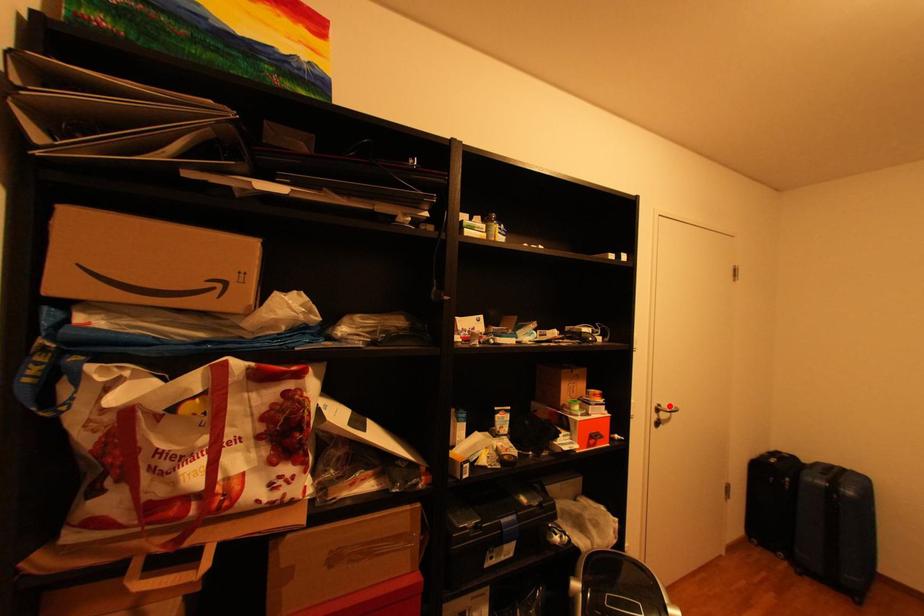
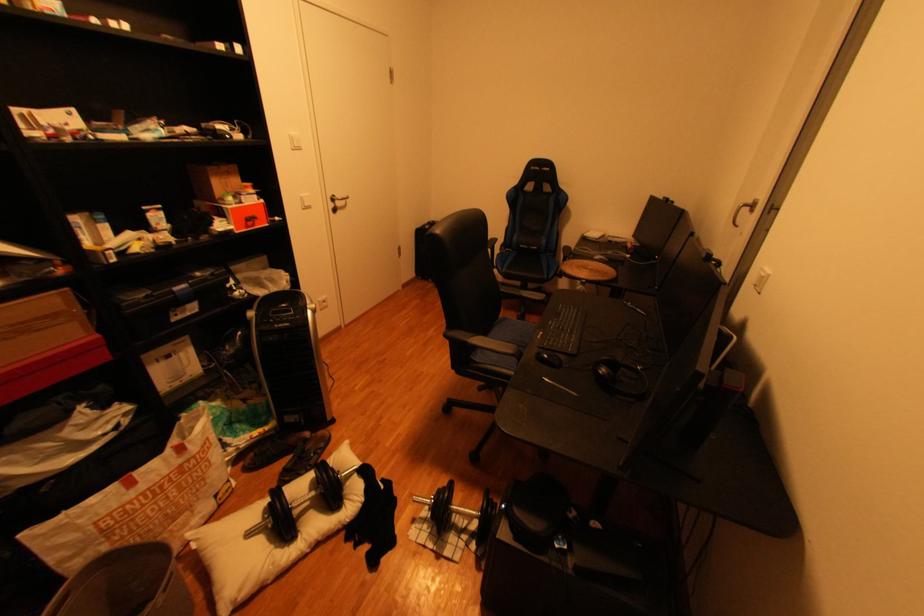
Locate, in the second image, the point that corresponds to the highlighted location in the first image.

(345, 197)